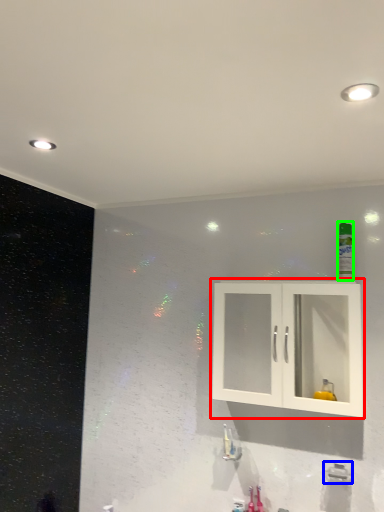
Question: Considering the real-world distances, which object is farthest from cabinetry (highlighted by a red box)? plumbing fixture (highlighted by a blue box) or mouthwash (highlighted by a green box)?

Choices:
 (A) plumbing fixture
 (B) mouthwash

Answer: (A)